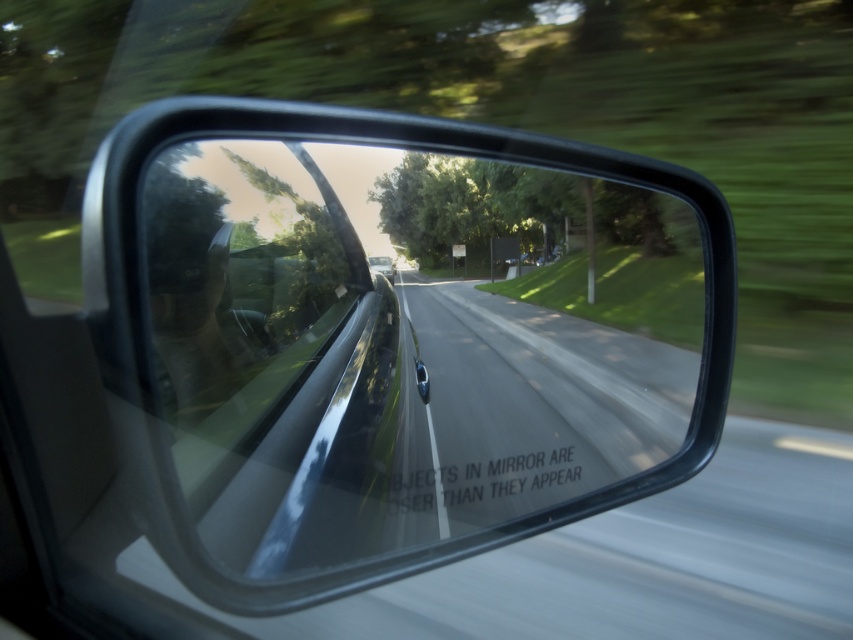
You are a driver checking your side mirror. You notice the glossy metallic mirror at center and the asphalt road at center. Which object takes up more space in your view?

The glossy metallic mirror at center is larger in size than the asphalt road at center, so it takes up more space in your view.

You are a driver checking your side mirror and see the asphalt road at center and the metallic silver car at center. Which object in the mirror is wider?

The asphalt road at center is wider than the metallic silver car at center in the mirror.